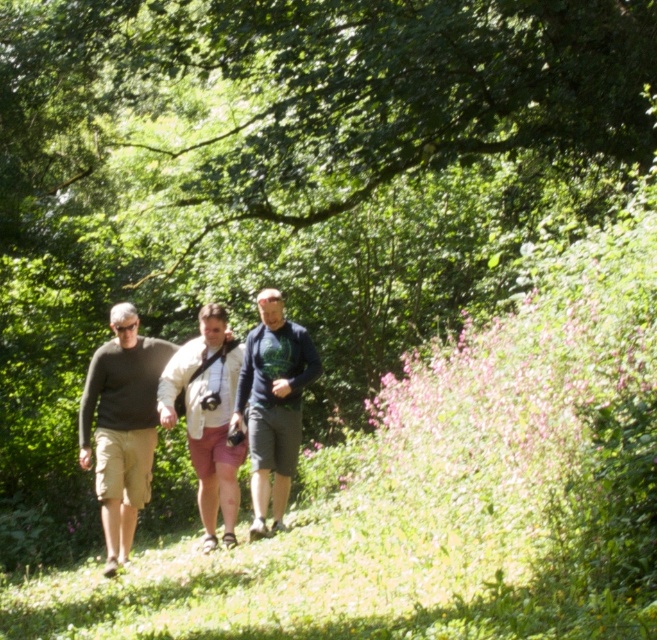
Does dark gray cotton shirt at center appear under dark gray sweater at center?

Actually, dark gray cotton shirt at center is above dark gray sweater at center.

Can you confirm if dark gray cotton shirt at center is smaller than dark gray sweater at center?

Yes.

Between point (118, 536) and point (127, 538), which one is positioned behind?

Point (127, 538)

Identify the location of dark gray cotton shirt at center. This screenshot has height=640, width=657. (208, 416).

Can you confirm if dark gray cotton shirt at center is positioned to the right of light beige cotton shorts at center?

Indeed, dark gray cotton shirt at center is positioned on the right side of light beige cotton shorts at center.

Is dark gray cotton shirt at center to the left of light beige cotton shorts at center from the viewer's perspective?

No, dark gray cotton shirt at center is not to the left of light beige cotton shorts at center.

Between point (204, 493) and point (164, 368), which one is positioned in front?

Point (164, 368)

Locate an element on the screen. dark gray cotton shirt at center is located at coordinates (208, 416).

Which of these two, dark green jersey at center or light beige cotton shorts at center, stands shorter?

Standing shorter between the two is dark green jersey at center.

Between dark green jersey at center and light beige cotton shorts at center, which one is positioned higher?

dark green jersey at center

The height and width of the screenshot is (640, 657). I want to click on dark green jersey at center, so click(273, 404).